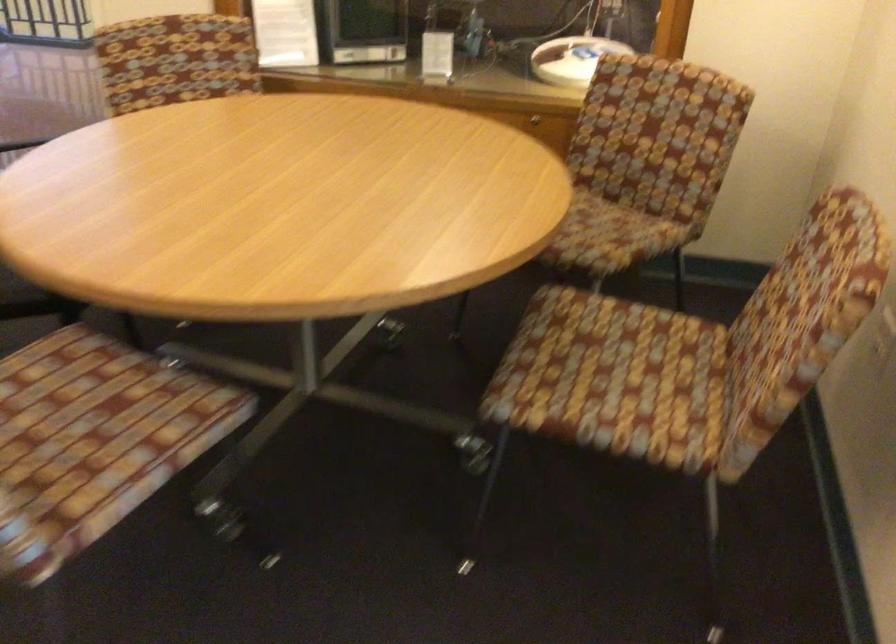
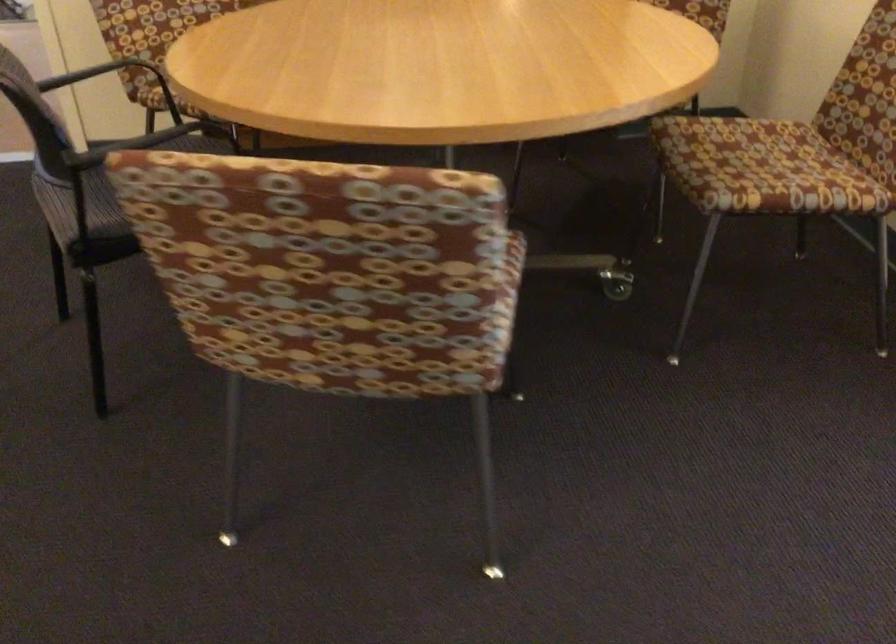
Question: In a continuous first-person perspective shot, in which direction is the camera moving?

Choices:
 (A) Left
 (B) Right
 (C) Forward
 (D) Backward

Answer: (A)